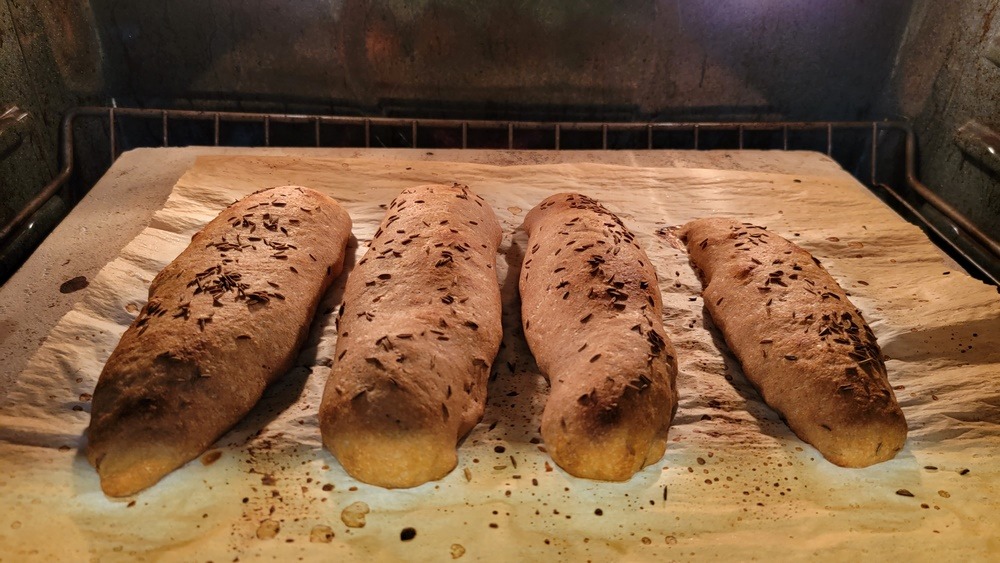
You are a GUI agent. You are given a task and a screenshot of the screen. Output one action in this format:
    pyautogui.click(x=<x>, y=<y>)
    Task: Click on the back wall of oven
    The height and width of the screenshot is (563, 1000).
    Given the screenshot: What is the action you would take?
    pyautogui.click(x=681, y=72)